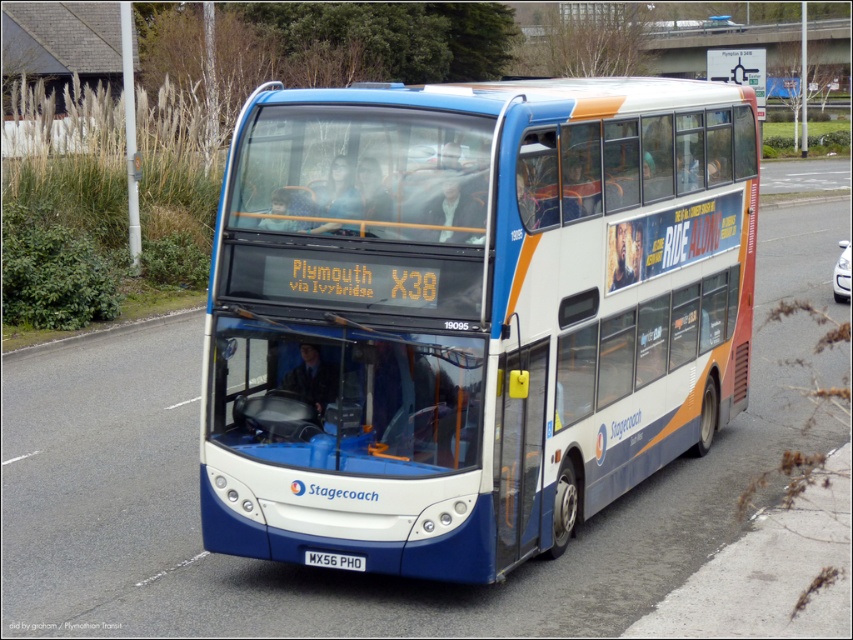
You are a delivery person who needs to place a rectangular box measuring 10 feet in length between the white glossy bus at center and the white metallic license plate at bottom. Can the box fit between them without overlapping either object?

The distance between the white glossy bus at center and the white metallic license plate at bottom is 9.82 feet. Since the box is 10 feet long, it cannot fit between them without overlapping either object.

You are a photographer trying to capture the entire white glossy bus at center and the white metallic license plate at bottom in a single shot. Considering their sizes, which object will appear bigger in your photo?

The white glossy bus at center will appear bigger in the photo since it has a larger size compared to the white metallic license plate at bottom.

You are standing on the sidewalk next to the road where the white glossy bus at center is driving. You want to cross the road to the other side. If the bus is moving at 30 mph, how much time do you have before the bus reaches your current position?

The white glossy bus at center and viewer are 21.92 feet apart from each other. At 30 mph, the bus travels 44 feet per second. Therefore, the time until the bus reaches your position is approximately 0.5 seconds. However, attempting to cross the road while a vehicle is approaching is dangerous and not recommended. Please wait for a safer opportunity.